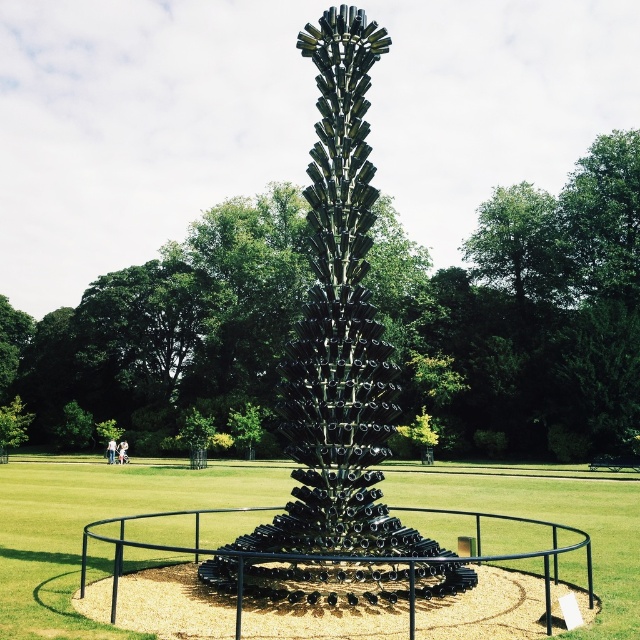
Between metallic sculpture at center and black glass sculpture at center, which one is positioned higher?

metallic sculpture at center is higher up.

Which is behind, point (634, 300) or point (36, 556)?

The point (634, 300) is behind.

The height and width of the screenshot is (640, 640). Identify the location of metallic sculpture at center. (524, 314).

Is point (344, 554) positioned behind point (464, 483)?

No, it is in front of (464, 483).

Does shiny metallic sculpture at center have a greater height compared to black glass sculpture at center?

Yes.

What do you see at coordinates (337, 369) in the screenshot?
I see `shiny metallic sculpture at center` at bounding box center [337, 369].

Where is `shiny metallic sculpture at center`? Image resolution: width=640 pixels, height=640 pixels. shiny metallic sculpture at center is located at coordinates pyautogui.click(x=337, y=369).

Who is taller, metallic sculpture at center or shiny metallic sculpture at center?

With more height is metallic sculpture at center.

Is metallic sculpture at center above shiny metallic sculpture at center?

Indeed, metallic sculpture at center is positioned over shiny metallic sculpture at center.

I want to click on metallic sculpture at center, so click(524, 314).